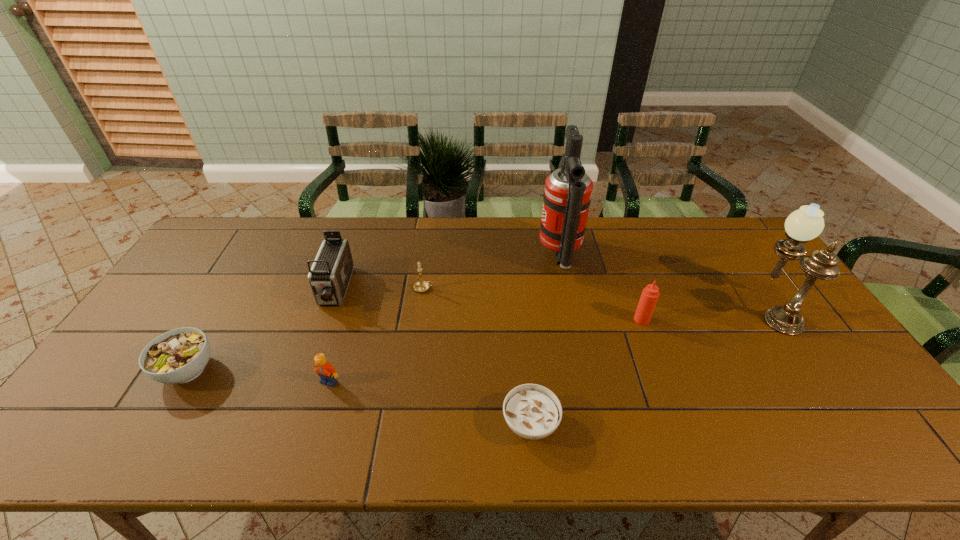
Image resolution: width=960 pixels, height=540 pixels. Identify the location of vacant space that is in between the Lego and the seventh shortest object. (552, 345).

Find the location of a particular element. This screenshot has height=540, width=960. empty space between the camcorder and the seventh tallest object is located at coordinates (261, 330).

Identify the location of object identified as the second closest to the farther soup bowl. (323, 368).

Point out which object is positioned as the second nearest to the camcorder. Please provide its 2D coordinates. Your answer should be formatted as a tuple, i.e. [(x, y)], where the tuple contains the x and y coordinates of a point satisfying the conditions above.

[(323, 368)]

You are a GUI agent. You are given a task and a screenshot of the screen. Output one action in this format:
    pyautogui.click(x=<x>, y=<y>)
    Task: Click on the free spot that satisfies the following two spatial constraints: 1. on the handle side of the candle holder; 2. on the left side of the Tabasco sauce
    The height and width of the screenshot is (540, 960).
    Given the screenshot: What is the action you would take?
    pyautogui.click(x=420, y=320)

In order to click on vacant space that satisfies the following two spatial constraints: 1. on the back side of the fifth object from left to right; 2. on the handle side of the candle holder in this screenshot , I will do `click(518, 288)`.

You are a GUI agent. You are given a task and a screenshot of the screen. Output one action in this format:
    pyautogui.click(x=<x>, y=<y>)
    Task: Click on the vacant space that satisfies the following two spatial constraints: 1. on the back side of the oil lamp; 2. on the handle side of the fifth object from right to left
    This screenshot has width=960, height=540.
    Given the screenshot: What is the action you would take?
    pyautogui.click(x=760, y=288)

What are the coordinates of `vacant area in the image that satisfies the following two spatial constraints: 1. on the handle side of the fifth object from right to left; 2. at the lens of the camcorder` in the screenshot? It's located at (424, 290).

Where is `vacant region that satisfies the following two spatial constraints: 1. on the handle side of the fifth object from right to left; 2. on the front-facing side of the Lego`? Image resolution: width=960 pixels, height=540 pixels. vacant region that satisfies the following two spatial constraints: 1. on the handle side of the fifth object from right to left; 2. on the front-facing side of the Lego is located at coordinates pos(412,381).

You are a GUI agent. You are given a task and a screenshot of the screen. Output one action in this format:
    pyautogui.click(x=<x>, y=<y>)
    Task: Click on the blank area in the image that satisfies the following two spatial constraints: 1. on the handle side of the fourth object from left to right; 2. at the lens of the camcorder
    The width and height of the screenshot is (960, 540).
    Given the screenshot: What is the action you would take?
    pyautogui.click(x=424, y=290)